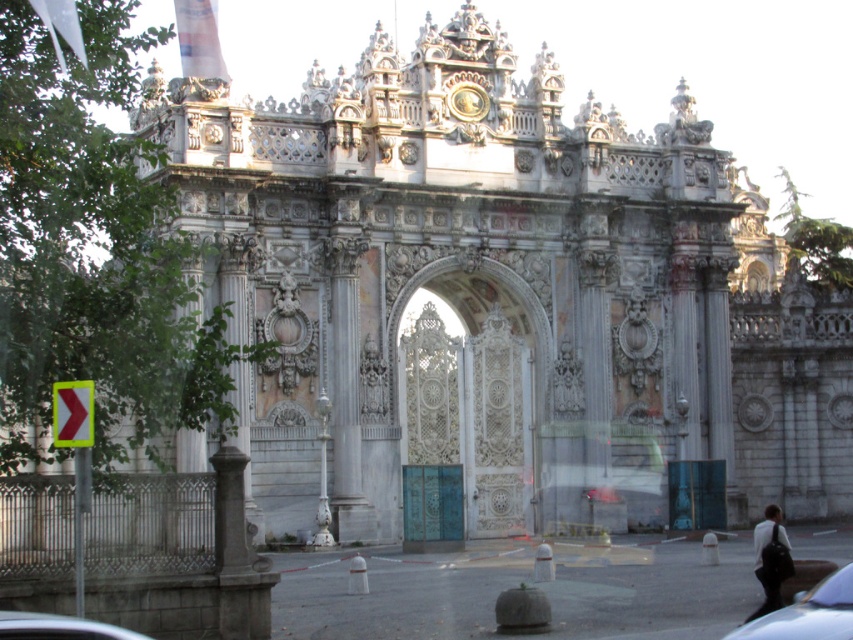
Question: Does white glossy car at lower right lie behind white glossy car at lower left?

Choices:
 (A) yes
 (B) no

Answer: (A)

Question: Which point is farther from the camera taking this photo?

Choices:
 (A) (755, 532)
 (B) (527, 493)
 (C) (44, 620)
 (D) (730, 636)

Answer: (B)

Question: Which point appears farthest from the camera in this image?

Choices:
 (A) (773, 520)
 (B) (68, 637)
 (C) (489, 307)
 (D) (811, 611)

Answer: (C)

Question: Is white glossy car at lower right in front of dark gray fabric bag at lower right?

Choices:
 (A) yes
 (B) no

Answer: (A)

Question: Where is white marble archway at center located in relation to white glossy car at lower right in the image?

Choices:
 (A) right
 (B) left

Answer: (B)

Question: Which of the following is the farthest from the observer?

Choices:
 (A) white marble archway at center
 (B) white glossy car at lower left

Answer: (A)